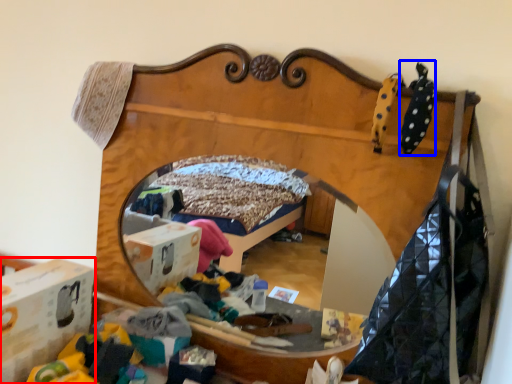
Question: Which object is further to the camera taking this photo, cardboard box (highlighted by a red box) or clothing (highlighted by a blue box)?

Choices:
 (A) cardboard box
 (B) clothing

Answer: (A)